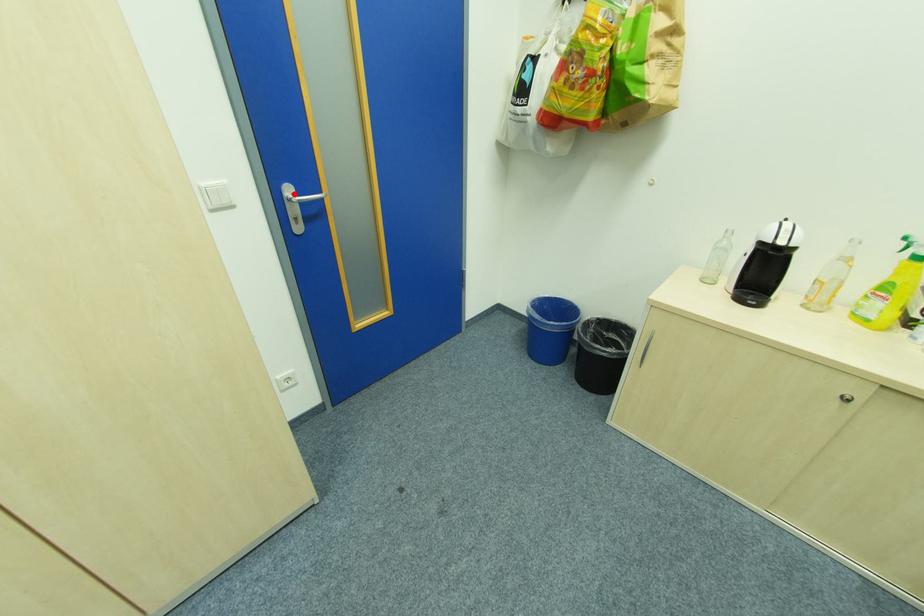
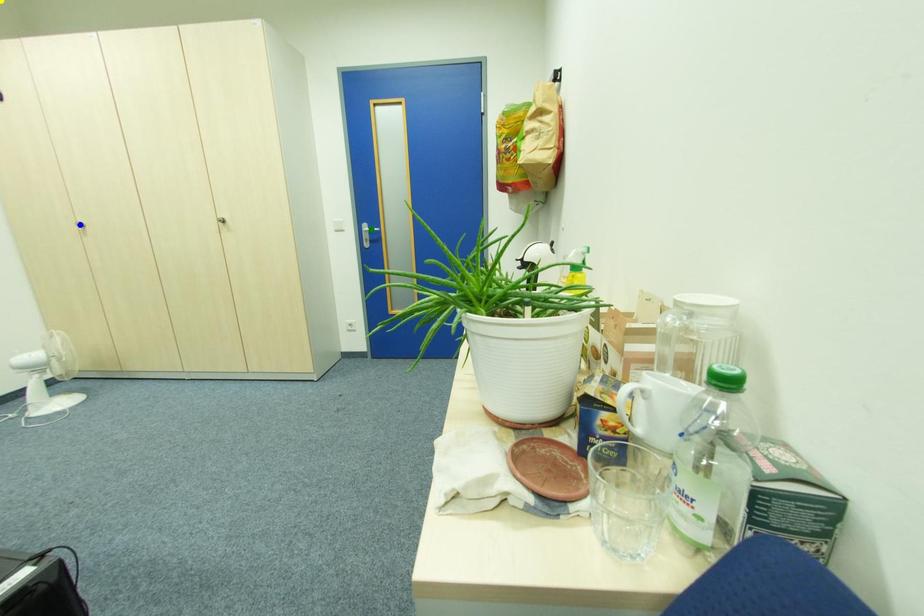
Question: I am providing you with two images of the same scene from different viewpoints. A red point is marked on the first image. You are given multiple points on the second image. Which point in image 2 is actually the same real-world point as the red point in image 1?

Choices:
 (A) green point
 (B) yellow point
 (C) blue point

Answer: (A)